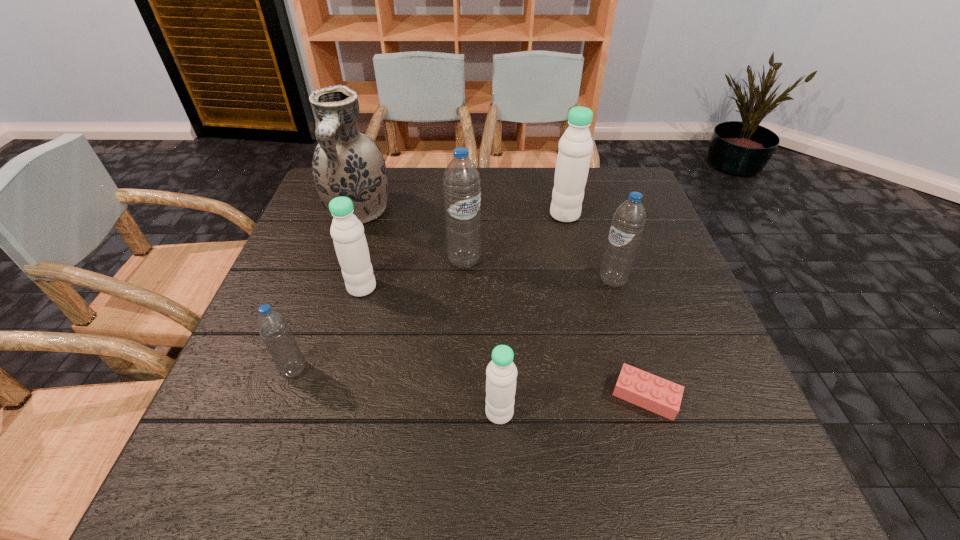
Find the location of a particular element. This screenshot has width=960, height=540. blue water bottle object that ranks as the closest to the fifth farthest water bottle is located at coordinates (461, 182).

Point out which blue water bottle is positioned as the nearest to the blue vase. Please provide its 2D coordinates. Your answer should be formatted as a tuple, i.e. [(x, y)], where the tuple contains the x and y coordinates of a point satisfying the conditions above.

[(461, 182)]

The image size is (960, 540). In order to click on free region that satisfies the following two spatial constraints: 1. with the handle on the side of the biggest blue water bottle; 2. on the left side of the vase in this screenshot , I will do `click(342, 261)`.

Find the location of a particular element. Image resolution: width=960 pixels, height=540 pixels. free location that satisfies the following two spatial constraints: 1. with the handle on the side of the Lego; 2. on the left side of the vase is located at coordinates (296, 396).

This screenshot has width=960, height=540. What are the coordinates of `free space that satisfies the following two spatial constraints: 1. on the front side of the fourth object from left to right; 2. on the left side of the second smallest blue water bottle` in the screenshot? It's located at (464, 280).

Where is `free region that satisfies the following two spatial constraints: 1. on the front side of the farthest white water bottle; 2. on the right side of the pink Lego`? The height and width of the screenshot is (540, 960). free region that satisfies the following two spatial constraints: 1. on the front side of the farthest white water bottle; 2. on the right side of the pink Lego is located at coordinates (607, 396).

Locate an element on the screen. Image resolution: width=960 pixels, height=540 pixels. blank area in the image that satisfies the following two spatial constraints: 1. with the handle on the side of the Lego; 2. on the right side of the blue vase is located at coordinates [x=296, y=396].

Where is `free spot that satisfies the following two spatial constraints: 1. on the back side of the smallest white water bottle; 2. on the right side of the Lego`? free spot that satisfies the following two spatial constraints: 1. on the back side of the smallest white water bottle; 2. on the right side of the Lego is located at coordinates (499, 396).

Where is `free space that satisfies the following two spatial constraints: 1. on the front side of the rightmost water bottle; 2. on the left side of the fourth water bottle from right to left`? The image size is (960, 540). free space that satisfies the following two spatial constraints: 1. on the front side of the rightmost water bottle; 2. on the left side of the fourth water bottle from right to left is located at coordinates (464, 280).

At what (x,y) coordinates should I click in order to perform the action: click on vacant area that satisfies the following two spatial constraints: 1. with the handle on the side of the vase; 2. on the left side of the third water bottle from right to left. Please return your answer as a coordinate pair (x, y). Looking at the image, I should click on (291, 413).